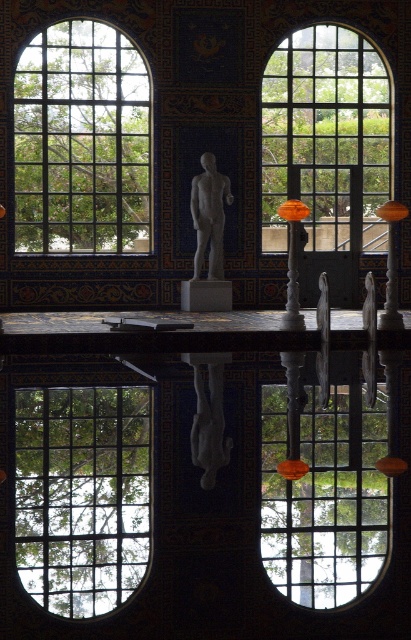
You are standing in the room and want to take a photo of the clear glass window at center and the gray marble statue at center. If your camera can focus on objects up to 15 meters away, will both objects be in focus?

The clear glass window at center is 13.89 meters away from the gray marble statue at center. Since the camera can focus up to 15 meters, both objects are within the focusing range and will be in focus.

You are standing in the room and want to look outside through the clear glass window at center and the clear glass window at upper center. Which window allows you to see the outside more clearly?

The clear glass window at center is closer to the viewer than the clear glass window at upper center, so it allows you to see the outside more clearly.